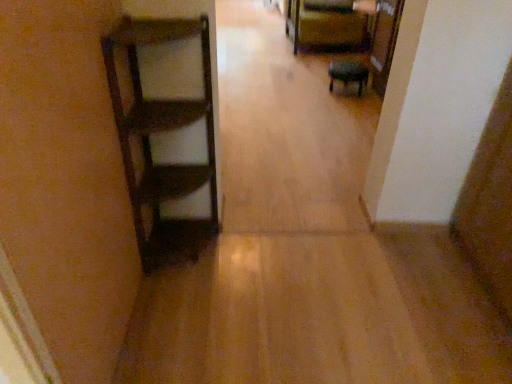
Locate an element on the screen. This screenshot has height=384, width=512. matte black stool at center, the second furniture positioned from the top is located at coordinates (348, 74).

What do you see at coordinates (348, 74) in the screenshot? I see `matte black stool at center, marked as the 1th furniture in a front-to-back arrangement` at bounding box center [348, 74].

What is the approximate width of matte black stool at center, the second furniture positioned from the top?

matte black stool at center, the second furniture positioned from the top, is 13.41 inches wide.

What do you see at coordinates (325, 26) in the screenshot? Image resolution: width=512 pixels, height=384 pixels. I see `matte brown chair at upper center, which is the 1th furniture from top to bottom` at bounding box center [325, 26].

This screenshot has width=512, height=384. In order to click on matte brown chair at upper center, positioned as the first furniture in back-to-front order in this screenshot , I will do `click(325, 26)`.

Identify the location of matte black stool at center, which is the first furniture in bottom-to-top order. (348, 74).

Visually, is matte brown chair at upper center, positioned as the first furniture in back-to-front order, positioned to the left or to the right of matte black stool at center, the second furniture positioned from the top?

Based on their positions, matte brown chair at upper center, positioned as the first furniture in back-to-front order, is located to the left of matte black stool at center, the second furniture positioned from the top.

Looking at this image, is matte brown chair at upper center, the second furniture positioned from the bottom, behind matte black stool at center, which is the first furniture in bottom-to-top order?

Yes, matte brown chair at upper center, the second furniture positioned from the bottom, is behind matte black stool at center, which is the first furniture in bottom-to-top order.

Is point (297, 31) positioned behind point (345, 63)?

That is True.

From the image's perspective, relative to matte black stool at center, the second furniture positioned from the top, is matte brown chair at upper center, which is the 1th furniture from top to bottom, above or below?

Based on their image positions, matte brown chair at upper center, which is the 1th furniture from top to bottom, is located above matte black stool at center, the second furniture positioned from the top.

From a real-world perspective, is matte brown chair at upper center, the second furniture positioned from the bottom, positioned above or below matte black stool at center, the second furniture viewed from the back?

From a real-world perspective, matte brown chair at upper center, the second furniture positioned from the bottom, is physically above matte black stool at center, the second furniture viewed from the back.

Between matte brown chair at upper center, which is the 1th furniture from top to bottom, and matte black stool at center, marked as the 1th furniture in a front-to-back arrangement, which one has smaller width?

matte black stool at center, marked as the 1th furniture in a front-to-back arrangement, is thinner.

Considering the sizes of objects matte brown chair at upper center, the second furniture positioned from the bottom, and matte black stool at center, marked as the 1th furniture in a front-to-back arrangement, in the image provided, who is shorter, matte brown chair at upper center, the second furniture positioned from the bottom, or matte black stool at center, marked as the 1th furniture in a front-to-back arrangement,?

With less height is matte black stool at center, marked as the 1th furniture in a front-to-back arrangement.

Who is bigger, matte brown chair at upper center, which is the 1th furniture from top to bottom, or matte black stool at center, the second furniture viewed from the back?

Bigger between the two is matte brown chair at upper center, which is the 1th furniture from top to bottom.

Is matte brown chair at upper center, the second furniture positioned from the bottom, outside of matte black stool at center, marked as the 1th furniture in a front-to-back arrangement?

matte brown chair at upper center, the second furniture positioned from the bottom, lies outside matte black stool at center, marked as the 1th furniture in a front-to-back arrangement,'s area.

Is matte brown chair at upper center, marked as the second furniture in a front-to-back arrangement, placed right next to matte black stool at center, which is the first furniture in bottom-to-top order?

No, matte brown chair at upper center, marked as the second furniture in a front-to-back arrangement, is not in contact with matte black stool at center, which is the first furniture in bottom-to-top order.

Does matte brown chair at upper center, the second furniture positioned from the bottom, turn towards matte black stool at center, the second furniture viewed from the back?

Yes, matte brown chair at upper center, the second furniture positioned from the bottom, is oriented towards matte black stool at center, the second furniture viewed from the back.

Locate an element on the screen. This screenshot has width=512, height=384. furniture lying in front of the matte brown chair at upper center, the second furniture positioned from the bottom is located at coordinates (348, 74).

Considering the relative positions of matte black stool at center, the second furniture viewed from the back, and matte brown chair at upper center, which is the 1th furniture from top to bottom, in the image provided, is matte black stool at center, the second furniture viewed from the back, to the left or to the right of matte brown chair at upper center, which is the 1th furniture from top to bottom,?

Clearly, matte black stool at center, the second furniture viewed from the back, is on the right of matte brown chair at upper center, which is the 1th furniture from top to bottom, in the image.

Is matte black stool at center, the second furniture viewed from the back, positioned behind matte brown chair at upper center, which is the 1th furniture from top to bottom?

No, matte black stool at center, the second furniture viewed from the back, is closer to the camera.

Is point (354, 77) farther from viewer compared to point (359, 45)?

No, it is not.

From the image's perspective, who appears lower, matte black stool at center, marked as the 1th furniture in a front-to-back arrangement, or matte brown chair at upper center, the second furniture positioned from the bottom?

matte black stool at center, marked as the 1th furniture in a front-to-back arrangement, from the image's perspective.

From a real-world perspective, which object stands above the other?

In real-world perspective, matte brown chair at upper center, positioned as the first furniture in back-to-front order, is above.

Which of these two, matte black stool at center, which is the first furniture in bottom-to-top order, or matte brown chair at upper center, marked as the second furniture in a front-to-back arrangement, is wider?

matte brown chair at upper center, marked as the second furniture in a front-to-back arrangement, is wider.

Based on the photo, can you confirm if matte black stool at center, the second furniture positioned from the top, is taller than matte brown chair at upper center, which is the 1th furniture from top to bottom?

No, matte black stool at center, the second furniture positioned from the top, is not taller than matte brown chair at upper center, which is the 1th furniture from top to bottom.

Considering the relative sizes of matte black stool at center, marked as the 1th furniture in a front-to-back arrangement, and matte brown chair at upper center, marked as the second furniture in a front-to-back arrangement, in the image provided, is matte black stool at center, marked as the 1th furniture in a front-to-back arrangement, smaller than matte brown chair at upper center, marked as the second furniture in a front-to-back arrangement,?

Yes, matte black stool at center, marked as the 1th furniture in a front-to-back arrangement, is smaller than matte brown chair at upper center, marked as the second furniture in a front-to-back arrangement.

Can matte brown chair at upper center, which is the 1th furniture from top to bottom, be found inside matte black stool at center, the second furniture positioned from the top?

Definitely not — matte brown chair at upper center, which is the 1th furniture from top to bottom, is not inside matte black stool at center, the second furniture positioned from the top.

Consider the image. Is matte black stool at center, the second furniture positioned from the top, placed right next to matte brown chair at upper center, positioned as the first furniture in back-to-front order?

No, matte black stool at center, the second furniture positioned from the top, is not touching matte brown chair at upper center, positioned as the first furniture in back-to-front order.

Does matte black stool at center, marked as the 1th furniture in a front-to-back arrangement, turn towards matte brown chair at upper center, positioned as the first furniture in back-to-front order?

No, matte black stool at center, marked as the 1th furniture in a front-to-back arrangement, is not facing towards matte brown chair at upper center, positioned as the first furniture in back-to-front order.

Where is `furniture in front of the matte brown chair at upper center, the second furniture positioned from the bottom`? The width and height of the screenshot is (512, 384). furniture in front of the matte brown chair at upper center, the second furniture positioned from the bottom is located at coordinates (348, 74).

The width and height of the screenshot is (512, 384). I want to click on furniture in front of the matte brown chair at upper center, which is the 1th furniture from top to bottom, so click(348, 74).

The image size is (512, 384). In order to click on furniture lying behind the matte black stool at center, which is the first furniture in bottom-to-top order in this screenshot , I will do tap(325, 26).